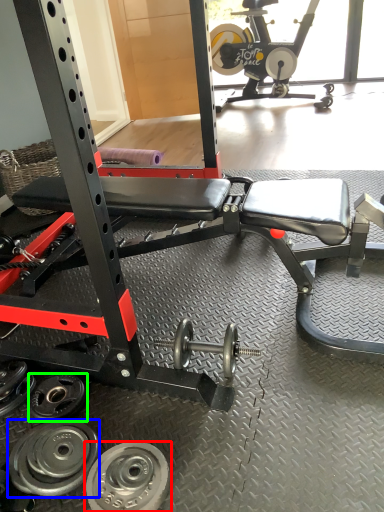
Question: Which object is positioned farthest from wheel (highlighted by a red box)? Select from wheel (highlighted by a blue box) and wheel (highlighted by a green box).

Choices:
 (A) wheel
 (B) wheel

Answer: (B)